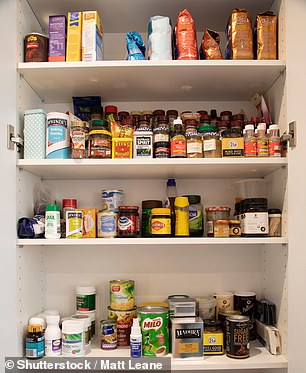
The width and height of the screenshot is (306, 373). Find the location of `product on top shelf`. product on top shelf is located at coordinates (40, 44), (65, 43), (92, 43), (75, 47), (144, 53), (160, 47), (186, 45), (208, 45), (238, 41), (266, 40).